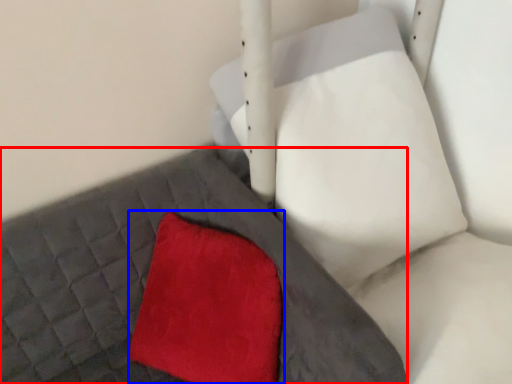
Question: Which object is closer to the camera taking this photo, bed frame (highlighted by a red box) or throw pillow (highlighted by a blue box)?

Choices:
 (A) bed frame
 (B) throw pillow

Answer: (A)